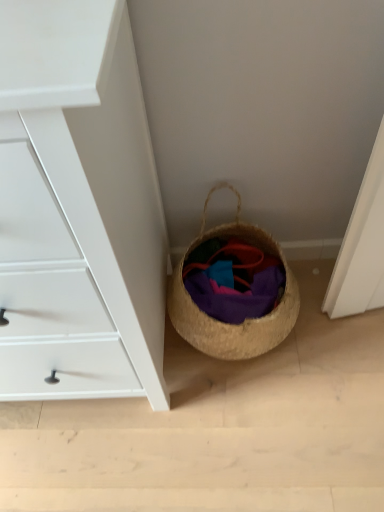
Question: Is woven straw basket at lower right spatially inside white matte chest of drawers at lower left, or outside of it?

Choices:
 (A) outside
 (B) inside

Answer: (A)

Question: Is woven straw basket at lower right in front of or behind white matte chest of drawers at lower left in the image?

Choices:
 (A) behind
 (B) front

Answer: (A)

Question: Which object is the closest to the white matte chest of drawers at lower left?

Choices:
 (A) woven straw basket at lower right
 (B) purple woven fabric at lower center

Answer: (A)

Question: Which is nearer to the purple woven fabric at lower center?

Choices:
 (A) woven straw basket at lower right
 (B) white matte chest of drawers at lower left

Answer: (A)